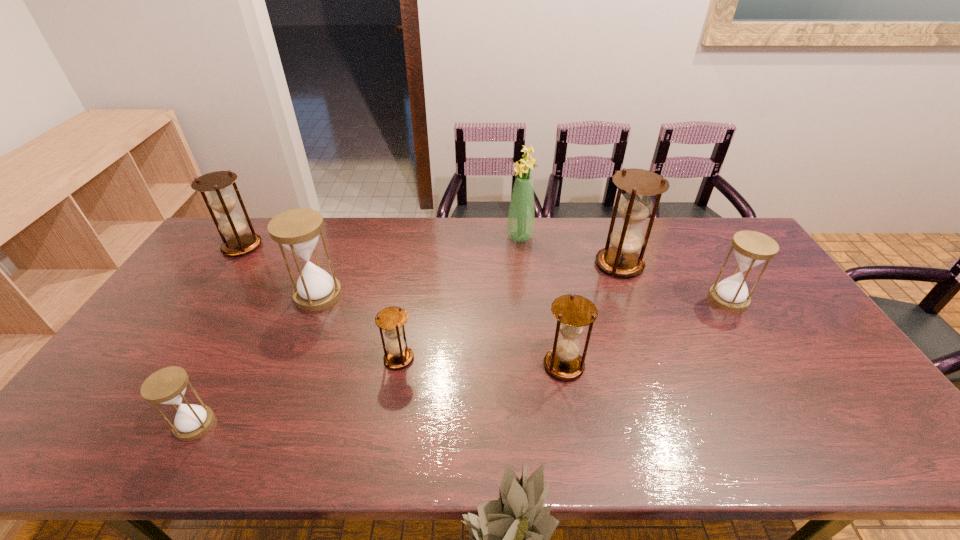
Where is `free spot at the far edge of the desktop`? This screenshot has height=540, width=960. free spot at the far edge of the desktop is located at coordinates (504, 241).

In the image, there is a desktop. In order to click on vacant space at the near edge in this screenshot , I will do `click(474, 429)`.

Where is `vacant region at the right edge`? The height and width of the screenshot is (540, 960). vacant region at the right edge is located at coordinates (808, 384).

You are a GUI agent. You are given a task and a screenshot of the screen. Output one action in this format:
    pyautogui.click(x=<x>, y=<y>)
    Task: Click on the vacant space at the far left corner
    The width and height of the screenshot is (960, 540).
    Given the screenshot: What is the action you would take?
    pyautogui.click(x=258, y=224)

The width and height of the screenshot is (960, 540). In the image, there is a desktop. Identify the location of free space at the near right corner. (882, 453).

Locate an element on the screen. free spot between the nearest white hourglass and the fifth object from right to left is located at coordinates (297, 392).

Identify the location of vacant space that is in between the second white hourglass from left to right and the rightmost hourglass. click(x=523, y=297).

Locate an element on the screen. empty space that is in between the third object from left to right and the rightmost object is located at coordinates (523, 297).

Find the location of a particular element. The width and height of the screenshot is (960, 540). vacant space that's between the leftmost white hourglass and the fifth hourglass from left to right is located at coordinates (379, 395).

Image resolution: width=960 pixels, height=540 pixels. Find the location of `free point between the rightmost brown hourglass and the rightmost hourglass`. free point between the rightmost brown hourglass and the rightmost hourglass is located at coordinates (674, 281).